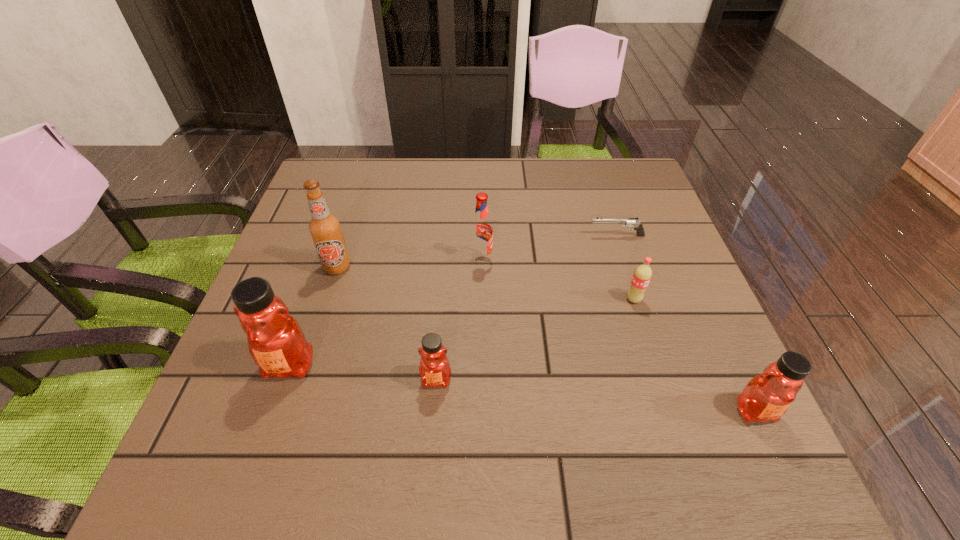
Select which honey appears as the second closest to the leftmost honey. Please provide its 2D coordinates. Your answer should be formatted as a tuple, i.e. [(x, y)], where the tuple contains the x and y coordinates of a point satisfying the conditions above.

[(767, 396)]

Find the location of a particular element. The height and width of the screenshot is (540, 960). honey that can be found as the third closest to the fourth farthest object is located at coordinates (276, 342).

At what (x,y) coordinates should I click in order to perform the action: click on vacant space that satisfies the following two spatial constraints: 1. on the front-facing side of the shortest object; 2. on the front label of the fifth object from right to left. Please return your answer as a coordinate pair (x, y). Looking at the image, I should click on (664, 380).

Locate an element on the screen. The image size is (960, 540). free space that satisfies the following two spatial constraints: 1. on the front-facing side of the pistol; 2. on the front label of the beer bottle is located at coordinates (627, 267).

Identify the location of free space in the image that satisfies the following two spatial constraints: 1. on the front-facing side of the pistol; 2. on the front label of the shortest honey. (664, 380).